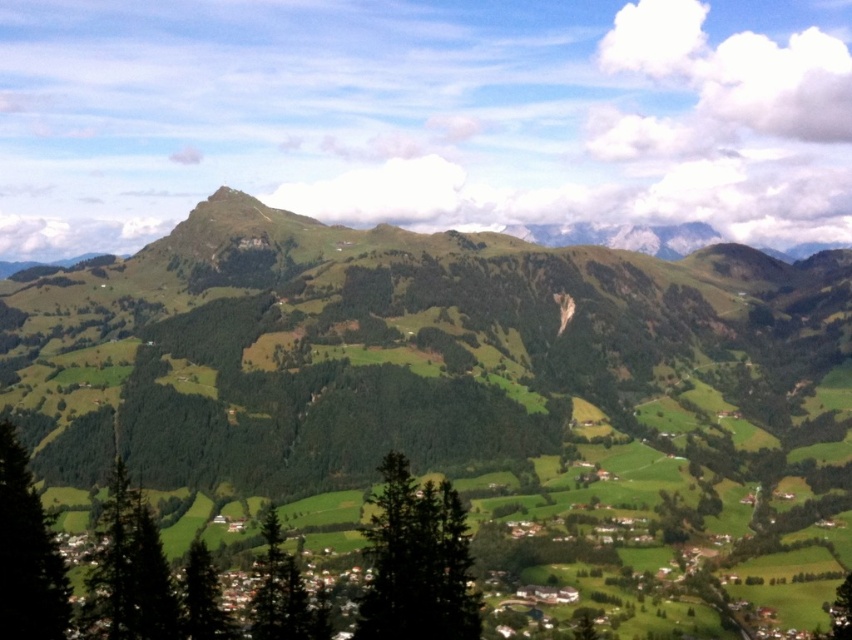
You are standing in the mountain landscape scene. The point at coordinates (130, 572) is marked. What object does this point indicate?

The point at coordinates (130, 572) marks the green textured tree at lower left.

You are an environmental scientist analyzing the density of trees in this mountainous landscape. You observe the green matte tree at lower left and the green matte tree at lower center. Which tree would you estimate has a larger canopy area based on their visual representation in the image?

The green matte tree at lower center has a larger canopy area than the green matte tree at lower left because it occupies more space in the image.